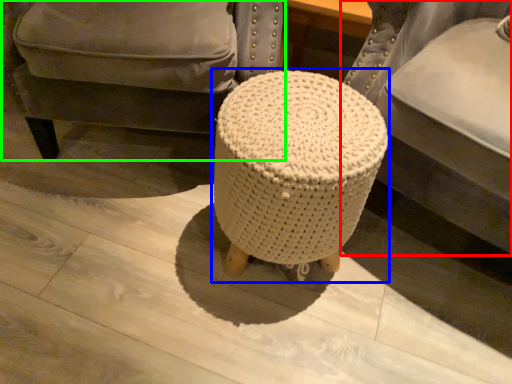
Question: Estimate the real-world distances between objects in this image. Which object is closer to furniture (highlighted by a red box), bar stool (highlighted by a blue box) or chair (highlighted by a green box)?

Choices:
 (A) bar stool
 (B) chair

Answer: (A)